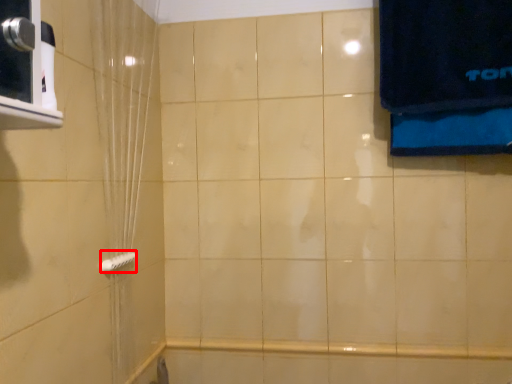
Question: In this image, where is towel bar (annotated by the red box) located relative to shower curtain?

Choices:
 (A) left
 (B) right

Answer: (A)